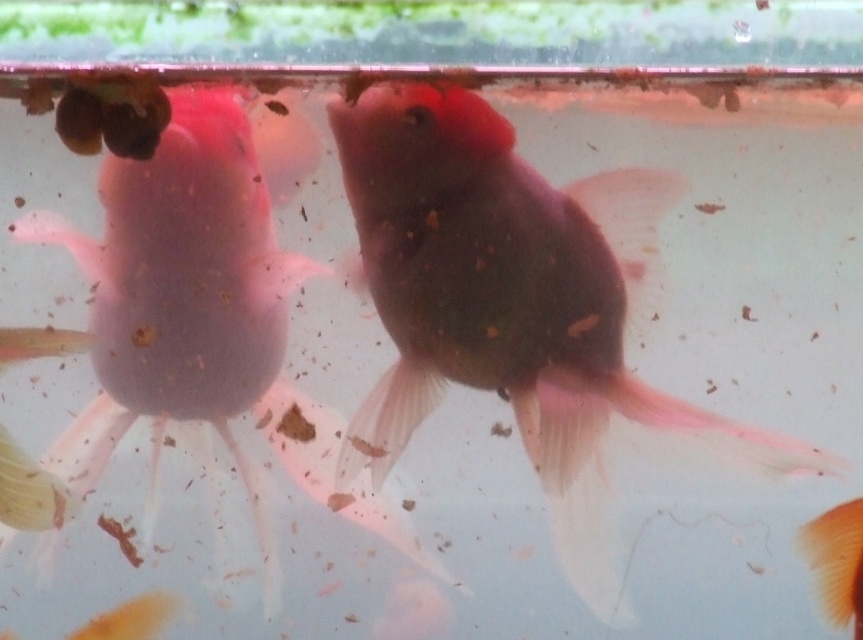
Question: Is matte pink goldfish at center above pink translucent fish at left?

Choices:
 (A) no
 (B) yes

Answer: (A)

Question: Which point appears farthest from the camera in this image?

Choices:
 (A) (117, 339)
 (B) (526, 371)

Answer: (B)

Question: Which object appears farthest from the camera in this image?

Choices:
 (A) matte pink goldfish at center
 (B) pink translucent fish at left

Answer: (A)

Question: Which of the following is the closest to the observer?

Choices:
 (A) matte pink goldfish at center
 (B) pink translucent fish at left

Answer: (B)

Question: Can you confirm if matte pink goldfish at center is wider than pink translucent fish at left?

Choices:
 (A) no
 (B) yes

Answer: (B)

Question: Does matte pink goldfish at center have a lesser width compared to pink translucent fish at left?

Choices:
 (A) yes
 (B) no

Answer: (B)